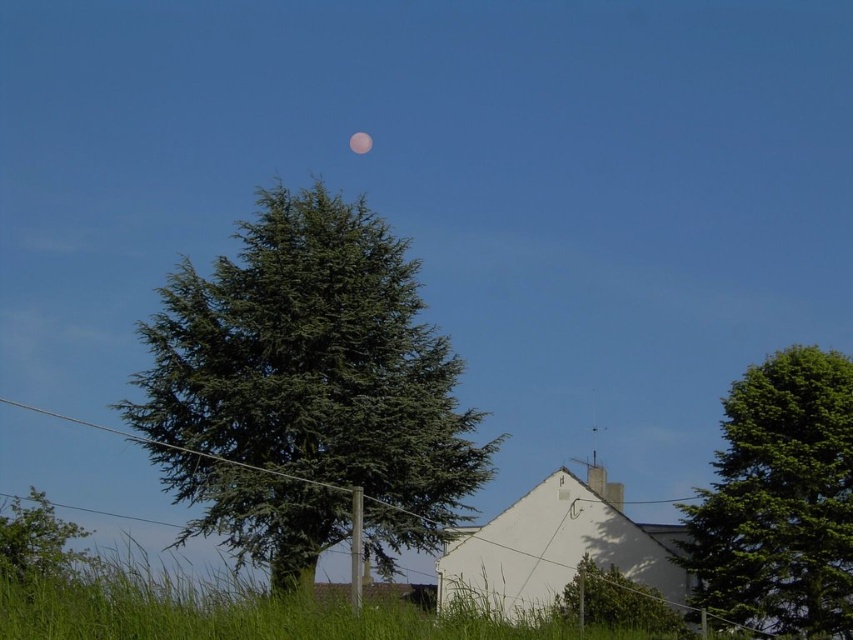
Question: Which of the following is the closest to the observer?

Choices:
 (A) (366, 138)
 (B) (817, 500)
 (C) (33, 499)
 (D) (287, 288)

Answer: (D)

Question: Can you confirm if green matte tree at lower right is smaller than pink translucent moon at upper center?

Choices:
 (A) no
 (B) yes

Answer: (A)

Question: Among these objects, which one is nearest to the camera?

Choices:
 (A) green needle-like at center
 (B) green leafy tree at lower left
 (C) green matte tree at lower right
 (D) pink translucent moon at upper center

Answer: (B)

Question: Does green leafy tree at right appear on the right side of green leafy tree at lower left?

Choices:
 (A) no
 (B) yes

Answer: (B)

Question: Which point appears closest to the camera in this image?

Choices:
 (A) (370, 141)
 (B) (4, 577)

Answer: (B)

Question: Can you confirm if green needle-like at center is bigger than pink translucent moon at upper center?

Choices:
 (A) yes
 (B) no

Answer: (A)